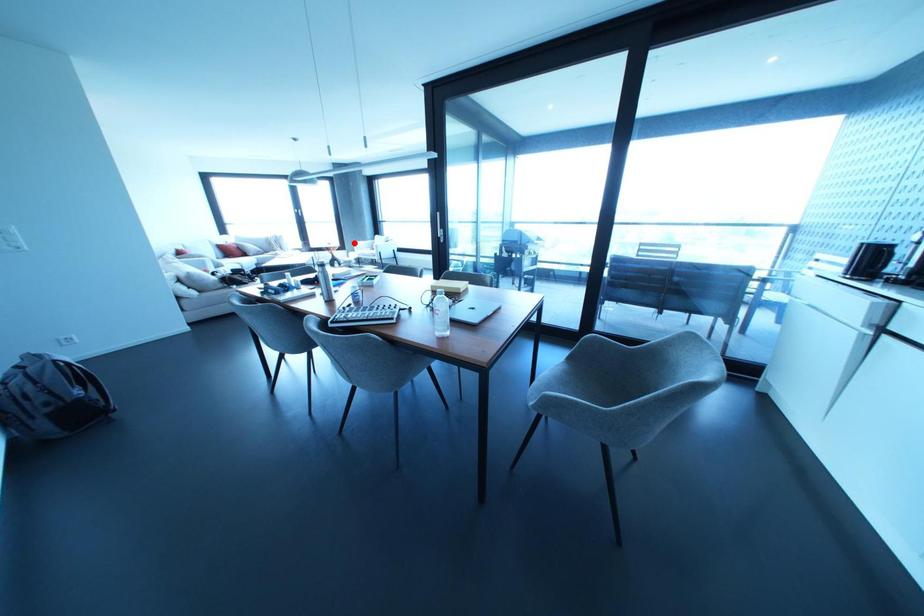
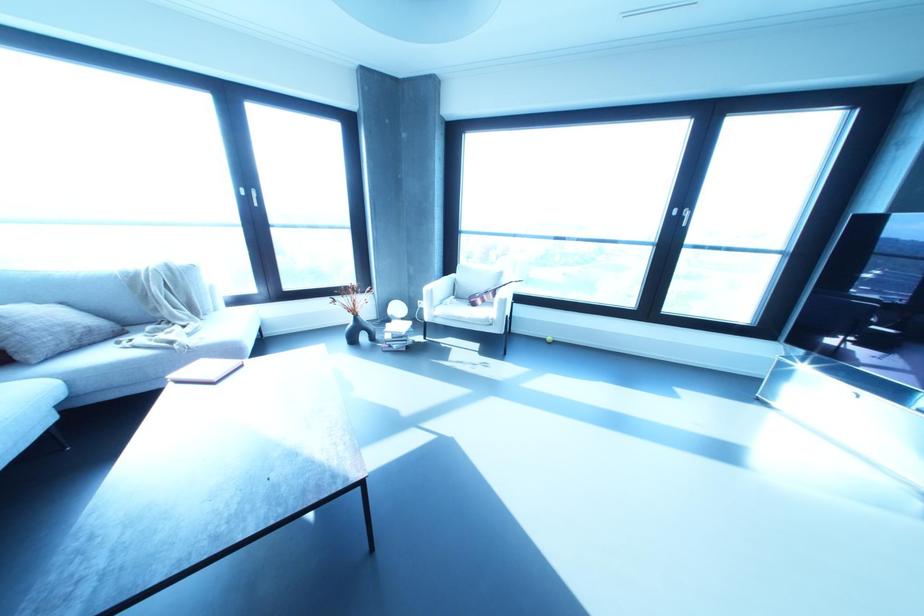
Question: I am providing you with two images of the same scene from different viewpoints. Image1 has a red point marked. In image2, the corresponding 3D location appears at what relative position? Reply with the corresponding letter.

Choices:
 (A) Closer
 (B) Farther

Answer: (B)